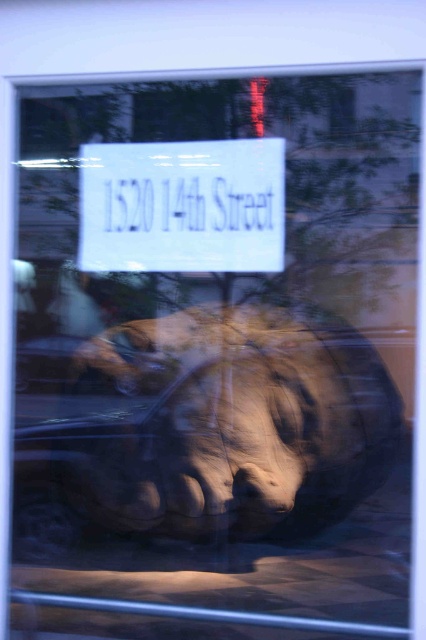
In the scene shown: Does matte brown sculpture at center appear on the left side of white paper sign at upper center?

In fact, matte brown sculpture at center is to the right of white paper sign at upper center.

Measure the distance between matte brown sculpture at center and white paper sign at upper center.

A distance of 17.92 inches exists between matte brown sculpture at center and white paper sign at upper center.

Who is more forward, (x=230, y=403) or (x=169, y=180)?

Positioned in front is point (x=169, y=180).

This screenshot has height=640, width=426. What are the coordinates of `matte brown sculpture at center` in the screenshot? It's located at (213, 428).

Describe the element at coordinates (183, 205) in the screenshot. I see `white paper sign at center` at that location.

Identify the location of white paper sign at center. The width and height of the screenshot is (426, 640). (183, 205).

Between point (222, 172) and point (155, 225), which one is positioned behind?

The point (155, 225) is more distant.

What are the coordinates of `white paper sign at center` in the screenshot? It's located at (183, 205).

Does matte brown sculpture at center have a larger size compared to white paper sign at center?

Correct, matte brown sculpture at center is larger in size than white paper sign at center.

Does matte brown sculpture at center lie behind white paper sign at center?

No, it is in front of white paper sign at center.

Which is in front, point (273, 500) or point (261, 266)?

Positioned in front is point (261, 266).

Identify the location of matte brown sculpture at center. (213, 428).